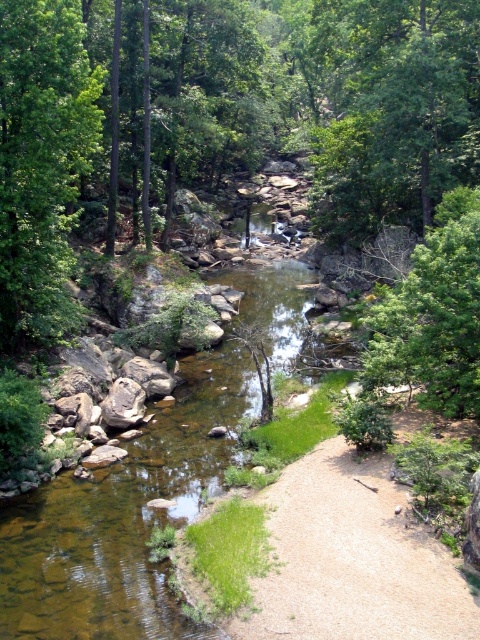
Who is lower down, green leafy tree at upper center or green leafy tree at left?

green leafy tree at left

Can you confirm if green leafy tree at upper center is positioned above green leafy tree at left?

Indeed, green leafy tree at upper center is positioned over green leafy tree at left.

Locate an element on the screen. The width and height of the screenshot is (480, 640). green leafy tree at upper center is located at coordinates (394, 109).

I want to click on green leafy tree at upper center, so click(x=394, y=109).

Which is below, green leafy tree at left or green leafy tree at center?

green leafy tree at center is below.

Is point (85, 83) closer to camera compared to point (429, 272)?

That is False.

Identify the location of green leafy tree at left. Image resolution: width=480 pixels, height=640 pixels. click(x=41, y=163).

Which is behind, point (429, 166) or point (466, 216)?

Positioned behind is point (429, 166).

In order to click on green leafy tree at upper center in this screenshot , I will do `click(394, 109)`.